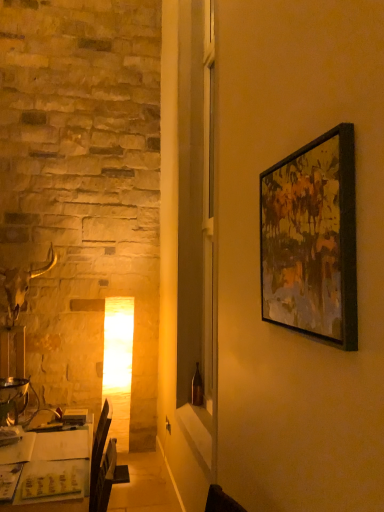
Question: Does white paper at lower left come in front of black matte picture frame at upper right?

Choices:
 (A) no
 (B) yes

Answer: (A)

Question: From the image's perspective, is white paper at lower left beneath black matte picture frame at upper right?

Choices:
 (A) no
 (B) yes

Answer: (B)

Question: Is white paper at lower left completely or partially outside of black matte picture frame at upper right?

Choices:
 (A) no
 (B) yes

Answer: (B)

Question: Is white paper at lower left with black matte picture frame at upper right?

Choices:
 (A) yes
 (B) no

Answer: (B)

Question: Can you confirm if white paper at lower left is shorter than black matte picture frame at upper right?

Choices:
 (A) yes
 (B) no

Answer: (B)

Question: Considering the relative positions of white paper at lower left and black matte picture frame at upper right in the image provided, is white paper at lower left to the left of black matte picture frame at upper right from the viewer's perspective?

Choices:
 (A) no
 (B) yes

Answer: (B)

Question: From a real-world perspective, is black matte picture frame at upper right physically below white paper at lower left?

Choices:
 (A) no
 (B) yes

Answer: (A)

Question: From the image's perspective, would you say black matte picture frame at upper right is positioned over white paper at lower left?

Choices:
 (A) yes
 (B) no

Answer: (A)

Question: Is black matte picture frame at upper right further to camera compared to white paper at lower left?

Choices:
 (A) yes
 (B) no

Answer: (B)

Question: Does black matte picture frame at upper right appear on the left side of white paper at lower left?

Choices:
 (A) yes
 (B) no

Answer: (B)

Question: Considering the relative sizes of black matte picture frame at upper right and white paper at lower left in the image provided, is black matte picture frame at upper right wider than white paper at lower left?

Choices:
 (A) no
 (B) yes

Answer: (A)

Question: Considering the relative sizes of black matte picture frame at upper right and white paper at lower left in the image provided, is black matte picture frame at upper right smaller than white paper at lower left?

Choices:
 (A) no
 (B) yes

Answer: (B)

Question: From the image's perspective, is black matte picture frame at upper right positioned above or below white paper at lower left?

Choices:
 (A) below
 (B) above

Answer: (B)